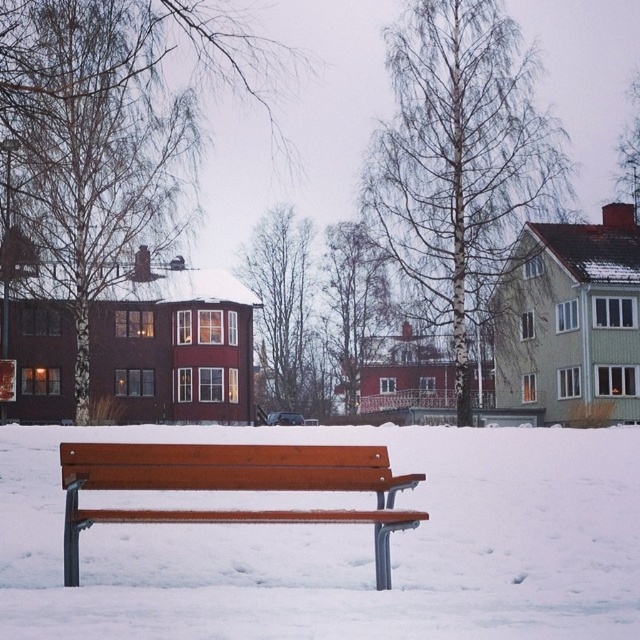
You are standing in the winter scene and want to walk from point A to point B. Point A is at coordinate point [326,536] and point B is at coordinate point [220,464]. Which direction should you move to get from point A to point B?

To move from point A at [326,536] to point B at [220,464], you should move towards the lower right direction since point B is closer to the viewer compared to point A.

You are a painter setting up your easel to capture the winter scene. You have two benches in front of you, the white matte bench at center and the wooden bench at center. Which bench should you choose to place your easel on if you want to ensure your artwork is at eye level with the houses in the background?

The wooden bench at center is taller than the white matte bench at center, so placing the easel on the wooden bench at center would bring the artwork to a height that aligns better with the eye level of the houses in the background.

You are planning to sit on the bench in the winter scene. Which bench, the white matte bench at center or the wooden bench at center, would you choose if you want to have more space to stretch your legs?

The white matte bench at center is larger in size than the wooden bench at center, so you should choose the white matte bench at center to have more space to stretch your legs.